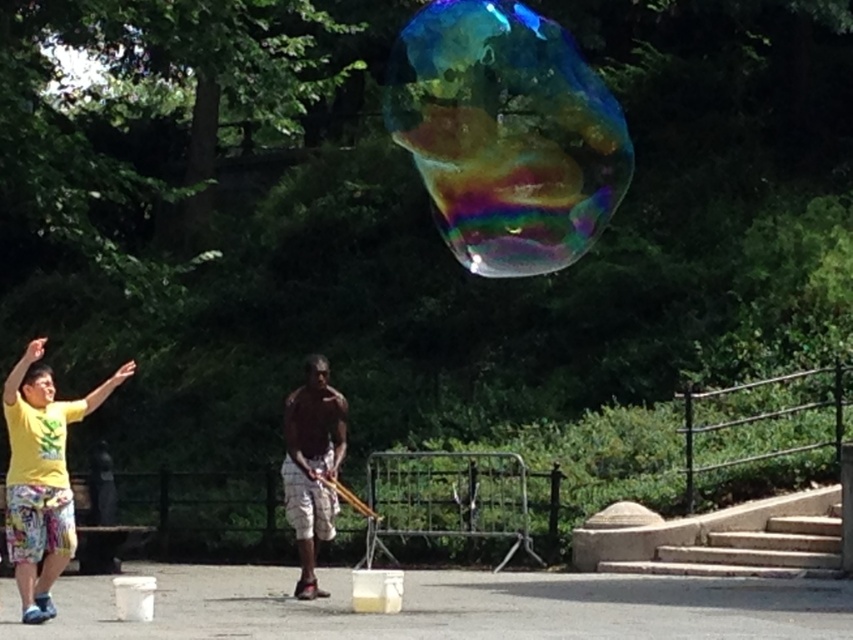
Question: Which of the following is the farthest from the observer?

Choices:
 (A) (573, 99)
 (B) (32, 589)
 (C) (331, 403)

Answer: (A)

Question: Which object is farther from the camera taking this photo?

Choices:
 (A) yellow cotton shirt at left
 (B) matte brown shorts at center
 (C) rainbow iridescent bubble at upper center

Answer: (C)

Question: From the image, what is the correct spatial relationship of rainbow iridescent bubble at upper center in relation to matte brown shorts at center?

Choices:
 (A) above
 (B) below

Answer: (A)

Question: Can you confirm if rainbow iridescent bubble at upper center is positioned below yellow cotton shirt at left?

Choices:
 (A) no
 (B) yes

Answer: (A)

Question: Based on their relative distances, which object is nearer to the yellow cotton shirt at left?

Choices:
 (A) matte brown shorts at center
 (B) rainbow iridescent bubble at upper center

Answer: (A)

Question: Can you confirm if rainbow iridescent bubble at upper center is thinner than matte brown shorts at center?

Choices:
 (A) no
 (B) yes

Answer: (B)